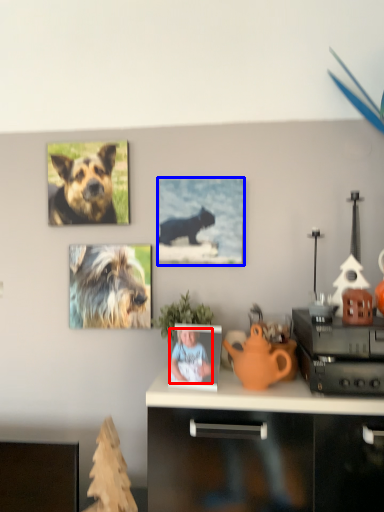
Question: Which object appears closest to the camera in this image, person (highlighted by a red box) or picture frame (highlighted by a blue box)?

Choices:
 (A) person
 (B) picture frame

Answer: (A)